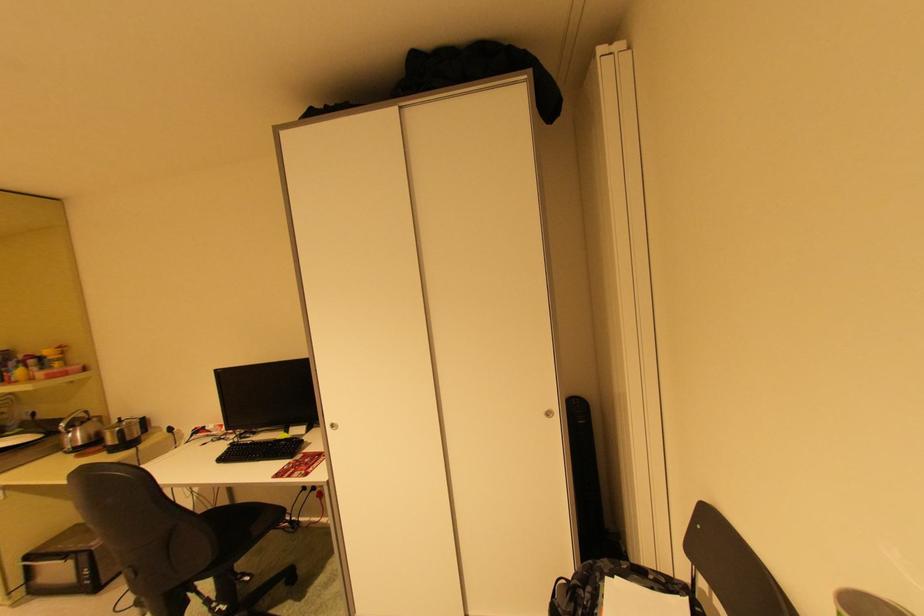
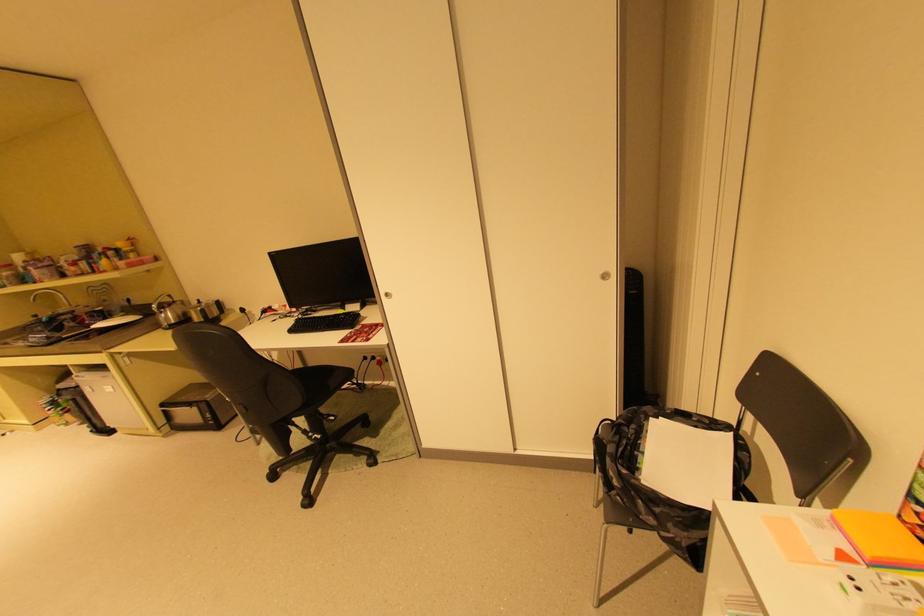
Find the pixel in the second image that matches point (597, 589) in the first image.

(640, 427)